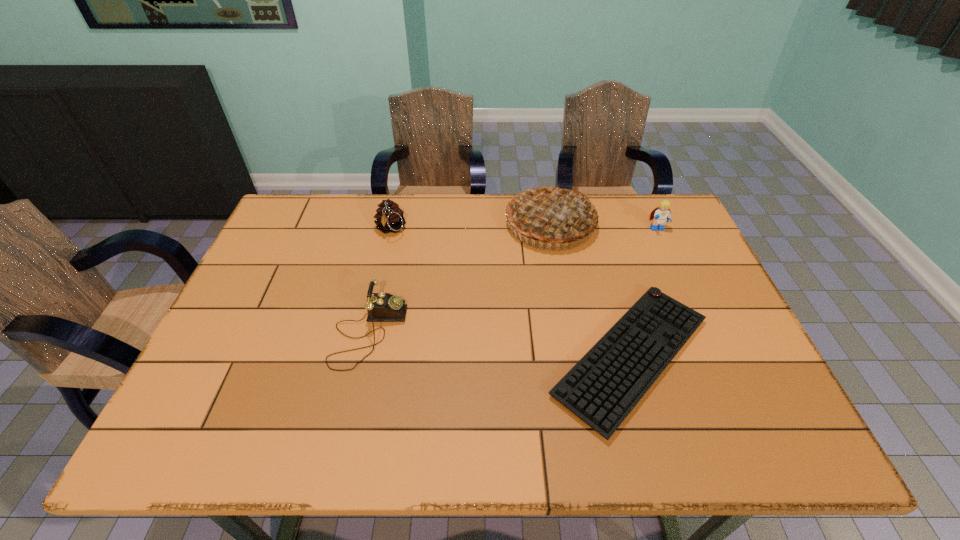
Identify the location of pie. pos(552,213).

Find the location of a particular element. The image size is (960, 540). pinecone is located at coordinates (389, 217).

The image size is (960, 540). What are the coordinates of `Lego` in the screenshot? It's located at (662, 214).

The height and width of the screenshot is (540, 960). What are the coordinates of `telephone` in the screenshot? It's located at (382, 307).

The image size is (960, 540). I want to click on computer keyboard, so click(602, 389).

Locate an element on the screen. free space located on the left of the tallest object is located at coordinates (470, 224).

The width and height of the screenshot is (960, 540). Identify the location of free space located 0.110m with a leaf charm attached to the pinecone. (382, 267).

At what (x,y) coordinates should I click in order to perform the action: click on vacant space located 0.250m on the front-facing side of the Lego. Please return your answer as a coordinate pair (x, y). Looking at the image, I should click on (686, 294).

You are a GUI agent. You are given a task and a screenshot of the screen. Output one action in this format:
    pyautogui.click(x=<x>, y=<y>)
    Task: Click on the vacant area situated 0.210m on the dial of the telephone
    This screenshot has width=960, height=540.
    Given the screenshot: What is the action you would take?
    pyautogui.click(x=487, y=333)

Where is `blank space located 0.210m on the left of the computer keyboard`? The height and width of the screenshot is (540, 960). blank space located 0.210m on the left of the computer keyboard is located at coordinates (455, 356).